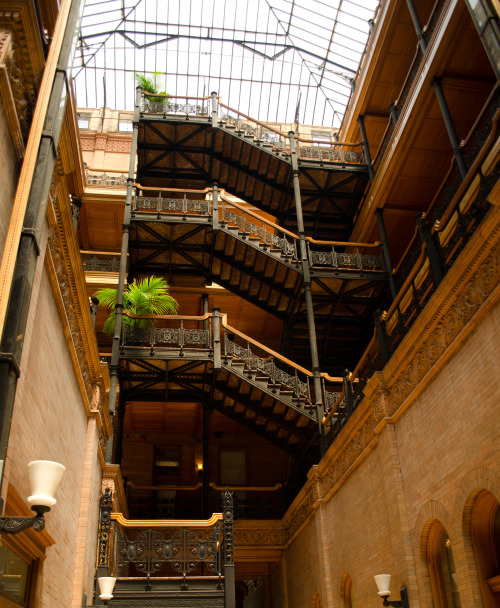
The height and width of the screenshot is (608, 500). In order to click on plant in this screenshot , I will do `click(145, 88)`.